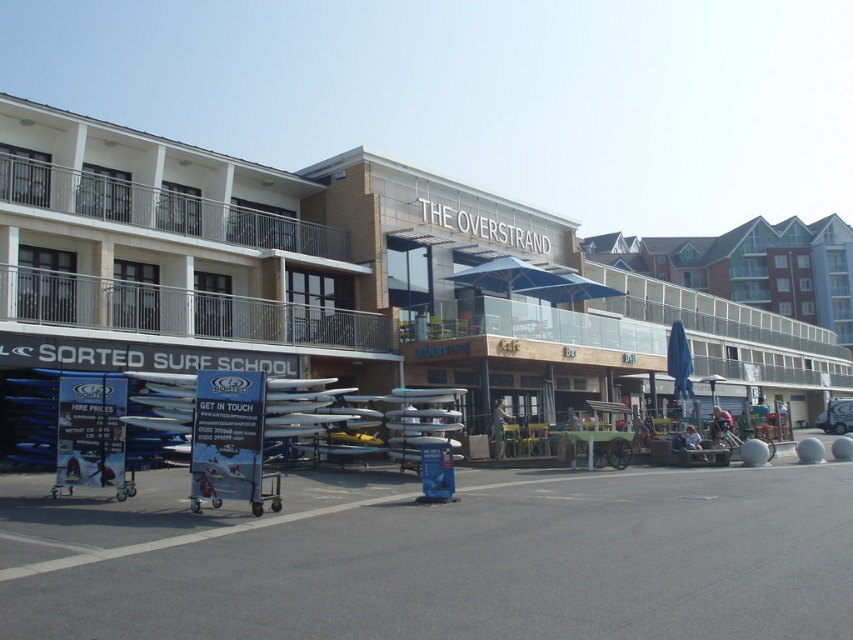
You are a tourist planning to take a photo of the beige brick building at center while sitting under the blue fabric umbrella at center. Is the building visible from that position?

The beige brick building at center is located above the blue fabric umbrella at center, so yes, the building is visible from under the umbrella.

You are standing in front of the beige brick building at center. You want to take a photo of the building with your phone, which has a maximum focus range of 15 meters. Will the building be in focus?

The beige brick building at center is 18.06 meters away from camera, which exceeds the phone camera maximum focus range of 15 meters. Therefore, the building will not be in focus.

You are a delivery person who needs to place a package between the beige brick building at center and the blue fabric umbrella at center. The package requires a space of 10 meters. Can you fit it between them?

The beige brick building at center and blue fabric umbrella at center are 11.26 meters apart from each other. Since the required space is 10 meters, the package can fit between them as the distance is sufficient.